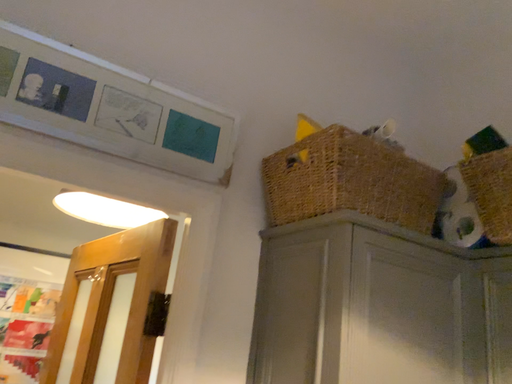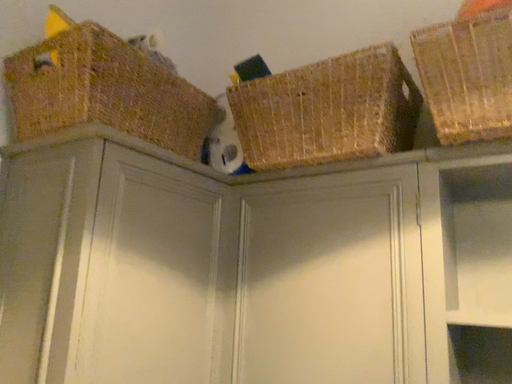
Question: Which way did the camera rotate in the video?

Choices:
 (A) rotated right
 (B) rotated left

Answer: (A)